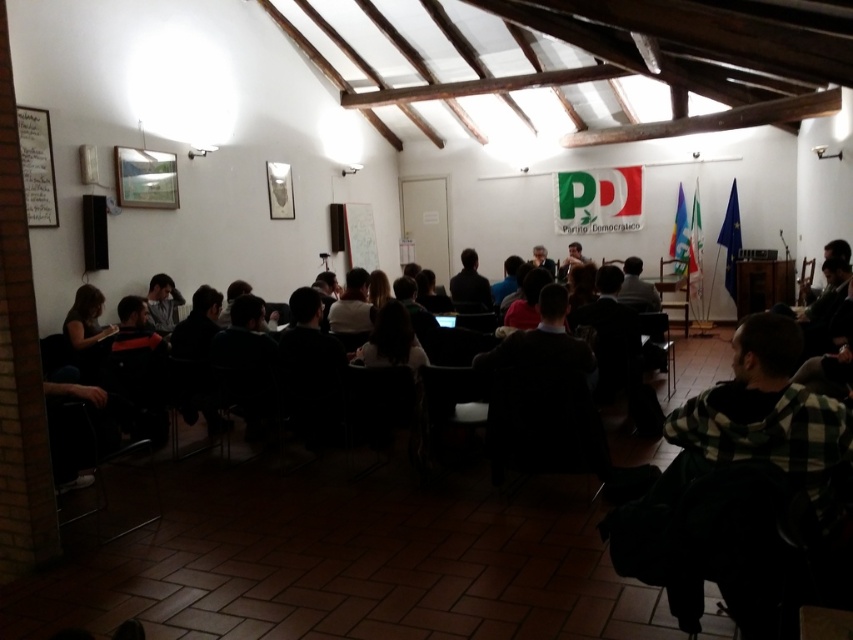
Which is below, dark brown leather chair at center or light gray shirt at left?

Answer: light gray shirt at left

Between point (469, 273) and point (155, 289), which one is positioned behind?

The point (469, 273) is more distant.

The width and height of the screenshot is (853, 640). I want to click on dark brown leather chair at center, so click(x=469, y=285).